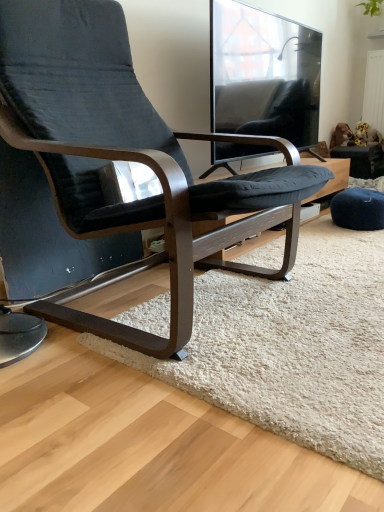
Describe the element at coordinates (263, 74) in the screenshot. I see `transparent glass window at upper center` at that location.

Image resolution: width=384 pixels, height=512 pixels. Describe the element at coordinates (292, 347) in the screenshot. I see `white shaggy rug at center` at that location.

What are the coordinates of `transparent glass window at upper center` in the screenshot? It's located at (263, 74).

What's the angular difference between matte black chair at center and transparent glass window at upper center's facing directions?

matte black chair at center and transparent glass window at upper center are facing 0.353 degrees away from each other.

Which object is positioned more to the right, matte black chair at center or transparent glass window at upper center?

Positioned to the right is transparent glass window at upper center.

From a real-world perspective, who is located lower, matte black chair at center or transparent glass window at upper center?

From a 3D spatial view, matte black chair at center is below.

Which is correct: matte black chair at center is inside transparent glass window at upper center, or outside of it?

matte black chair at center is not enclosed by transparent glass window at upper center.

Between white textured radiator at upper right and white shaggy rug at center, which one has smaller size?

white textured radiator at upper right is smaller.

Considering the positions of objects white textured radiator at upper right and white shaggy rug at center in the image provided, who is in front, white textured radiator at upper right or white shaggy rug at center?

white shaggy rug at center is in front.

In the scene shown: Is matte black chair at center facing away from white shaggy rug at center?

matte black chair at center does not have its back to white shaggy rug at center.

Between matte black chair at center and white shaggy rug at center, which one has smaller size?

white shaggy rug at center.

From a real-world perspective, between matte black chair at center and white shaggy rug at center, who is vertically higher?

In real-world perspective, matte black chair at center is above.

Considering the relative sizes of matte black chair at center and white shaggy rug at center in the image provided, is matte black chair at center thinner than white shaggy rug at center?

No.

Considering the relative sizes of transparent glass window at upper center and white textured radiator at upper right in the image provided, is transparent glass window at upper center smaller than white textured radiator at upper right?

No.

Identify the location of radiator located underneath the transparent glass window at upper center (from a real-world perspective). This screenshot has width=384, height=512. (374, 91).

From the image's perspective, is transparent glass window at upper center above or below white textured radiator at upper right?

transparent glass window at upper center is situated lower than white textured radiator at upper right in the image.

Considering the positions of point (240, 9) and point (380, 62), is point (240, 9) closer or farther from the camera than point (380, 62)?

Point (240, 9) is positioned closer to the camera compared to point (380, 62).

Is point (86, 91) behind point (370, 90)?

No, (86, 91) is in front of (370, 90).

Which of these two, matte black chair at center or white textured radiator at upper right, stands taller?

matte black chair at center is taller.

Does matte black chair at center turn towards white textured radiator at upper right?

No, matte black chair at center is not oriented towards white textured radiator at upper right.

This screenshot has width=384, height=512. Identify the location of radiator to the right of matte black chair at center. click(374, 91).

Is white shaggy rug at center far from matte black chair at center?

No, there isn't a large distance between white shaggy rug at center and matte black chair at center.

From the image's perspective, would you say white shaggy rug at center is positioned over matte black chair at center?

Incorrect, from the image's perspective, white shaggy rug at center is lower than matte black chair at center.

Does white shaggy rug at center contain matte black chair at center?

No, white shaggy rug at center does not contain matte black chair at center.

Between transparent glass window at upper center and matte black chair at center, which one has larger size?

With larger size is matte black chair at center.

Is matte black chair at center inside transparent glass window at upper center?

No.

Is transparent glass window at upper center oriented towards matte black chair at center?

No, transparent glass window at upper center is not oriented towards matte black chair at center.

Image resolution: width=384 pixels, height=512 pixels. I want to click on chair on the left side of transparent glass window at upper center, so click(128, 160).

Find the location of a particular element. Image resolution: width=384 pixels, height=512 pixels. radiator located above the white shaggy rug at center (from a real-world perspective) is located at coordinates (374, 91).

Estimate the real-world distances between objects in this image. Which object is further from white shaggy rug at center, matte black chair at center or transparent glass window at upper center?

The object further to white shaggy rug at center is transparent glass window at upper center.

Based on the photo, when comparing their distances from transparent glass window at upper center, does white shaggy rug at center or white textured radiator at upper right seem closer?

Based on the image, white shaggy rug at center appears to be nearer to transparent glass window at upper center.

Which object lies nearer to the anchor point white textured radiator at upper right, white shaggy rug at center or matte black chair at center?

white shaggy rug at center.

Looking at the image, which one is located further to transparent glass window at upper center, white shaggy rug at center or matte black chair at center?

white shaggy rug at center lies further to transparent glass window at upper center than the other object.

From the picture: Which object lies further to the anchor point white shaggy rug at center, matte black chair at center or white textured radiator at upper right?

The object further to white shaggy rug at center is white textured radiator at upper right.

Considering their positions, is white textured radiator at upper right positioned closer to transparent glass window at upper center than matte black chair at center?

Among the two, matte black chair at center is located nearer to transparent glass window at upper center.

From the image, which object appears to be farther from white textured radiator at upper right, transparent glass window at upper center or white shaggy rug at center?

Based on the image, white shaggy rug at center appears to be further to white textured radiator at upper right.

When comparing their distances from matte black chair at center, does white shaggy rug at center or transparent glass window at upper center seem closer?

white shaggy rug at center lies closer to matte black chair at center than the other object.

Image resolution: width=384 pixels, height=512 pixels. I want to click on mat between matte black chair at center and white textured radiator at upper right from front to back, so click(x=292, y=347).

I want to click on window between matte black chair at center and white textured radiator at upper right along the z-axis, so click(263, 74).

The height and width of the screenshot is (512, 384). Find the location of `mat between matte black chair at center and transparent glass window at upper center from front to back`. mat between matte black chair at center and transparent glass window at upper center from front to back is located at coordinates (292, 347).

The image size is (384, 512). Find the location of `window located between white shaggy rug at center and white textured radiator at upper right in the depth direction`. window located between white shaggy rug at center and white textured radiator at upper right in the depth direction is located at coordinates (263, 74).